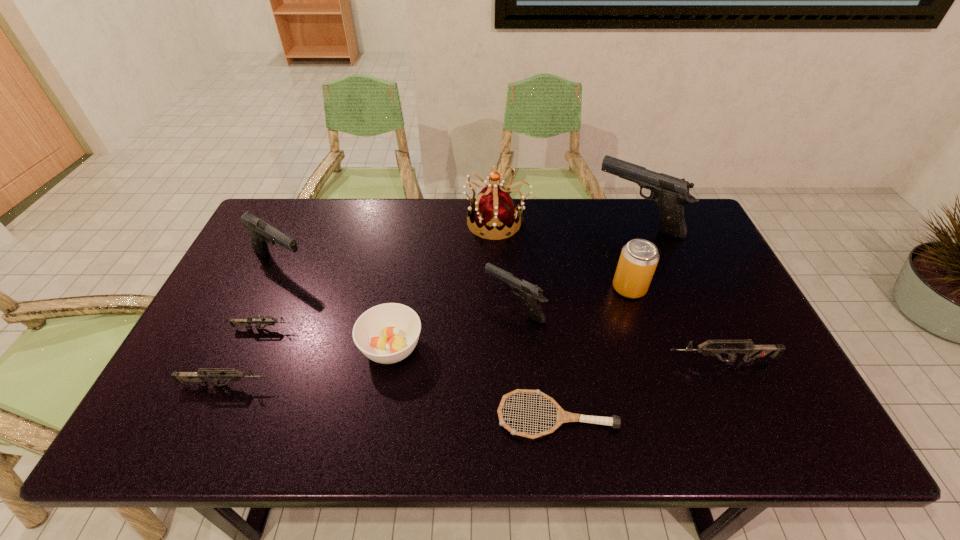
This screenshot has width=960, height=540. What are the coordinates of `soup bowl` in the screenshot? It's located at (387, 333).

This screenshot has height=540, width=960. Find the location of `the second nearest object`. the second nearest object is located at coordinates (234, 375).

Find the location of `the nearest gun`. the nearest gun is located at coordinates [x=234, y=375].

The image size is (960, 540). I want to click on the farthest grey gun, so tap(247, 322).

This screenshot has height=540, width=960. What are the coordinates of `the fourth farthest gun` in the screenshot? It's located at (247, 322).

In order to click on the shortest object in this screenshot , I will do `click(563, 416)`.

Locate an element on the screen. This screenshot has width=960, height=540. gray tennis racket is located at coordinates point(563,416).

Identify the location of free spot located on the front-facing side of the red tiara. The width and height of the screenshot is (960, 540). point(417,222).

Where is `free region located on the front-facing side of the red tiara`? Image resolution: width=960 pixels, height=540 pixels. free region located on the front-facing side of the red tiara is located at coordinates (411, 222).

At what (x,y) coordinates should I click in order to perform the action: click on vacant space situated 0.390m on the front-facing side of the red tiara. Please return your answer as a coordinate pair (x, y). Image resolution: width=960 pixels, height=540 pixels. Looking at the image, I should click on (348, 222).